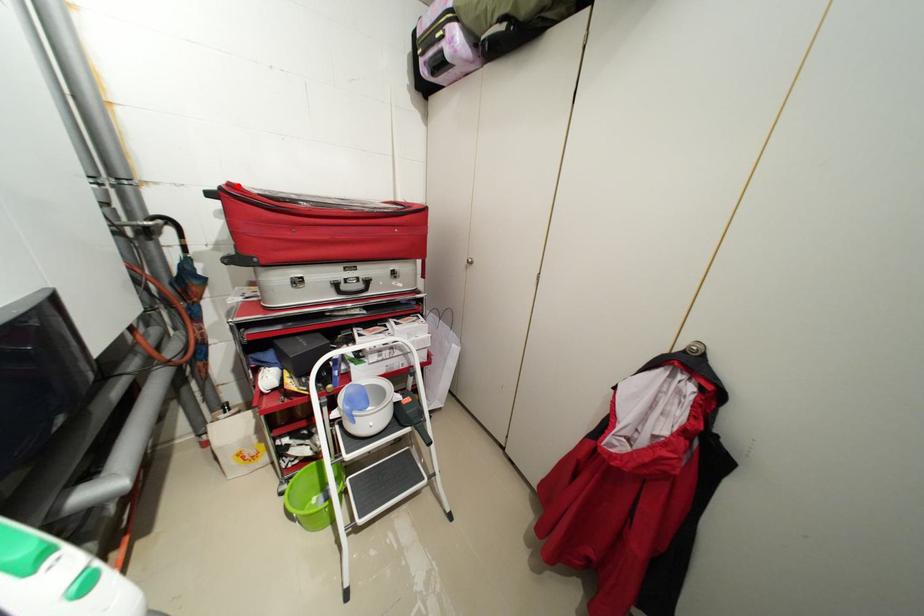
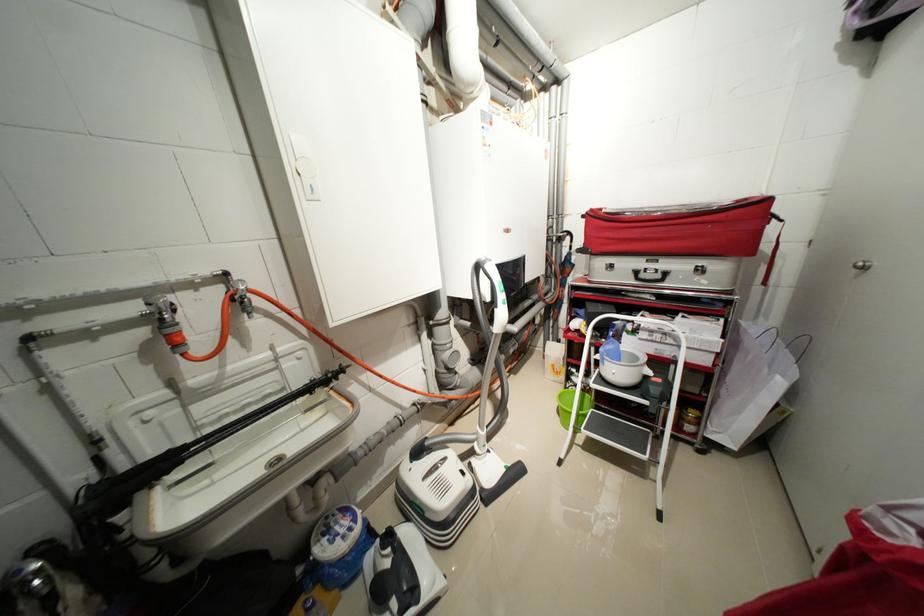
Question: I am providing you with two images of the same scene from different viewpoints. Given a red point in image1, look at the same physical point in image2. Is it:

Choices:
 (A) Closer to the viewpoint
 (B) Farther from the viewpoint

Answer: (A)